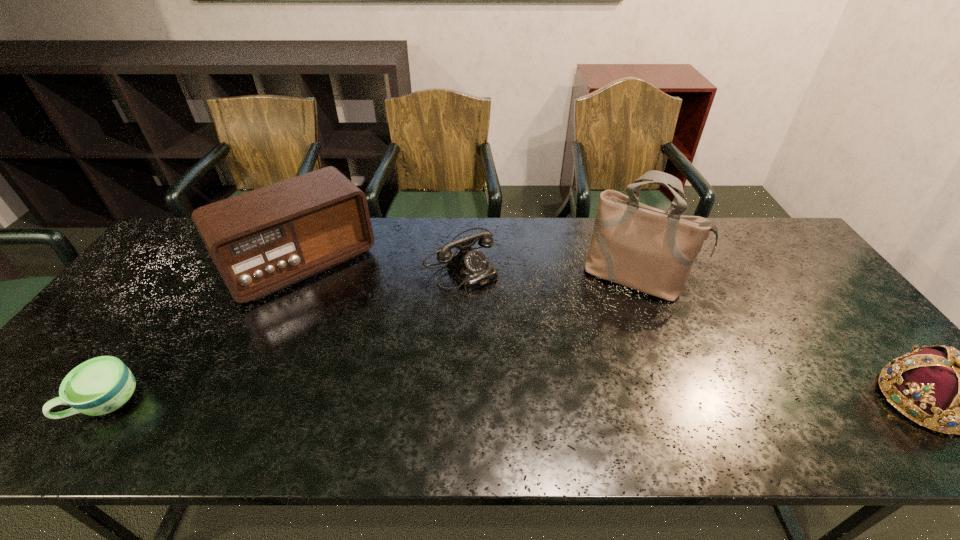
Where is `vacant area situated 0.330m on the front-facing side of the second object from right to left`? The image size is (960, 540). vacant area situated 0.330m on the front-facing side of the second object from right to left is located at coordinates (585, 389).

The width and height of the screenshot is (960, 540). Identify the location of free space located on the front-facing side of the second object from right to left. (589, 376).

This screenshot has width=960, height=540. What are the coordinates of `vacant space located on the front-facing side of the second object from right to left` in the screenshot? It's located at (583, 393).

The width and height of the screenshot is (960, 540). In order to click on vacant region located 0.250m on the front-facing side of the third object from right to left in this screenshot , I will do `click(529, 346)`.

Identify the location of free spot located on the front-facing side of the third object from right to left. This screenshot has width=960, height=540. (561, 383).

You are a GUI agent. You are given a task and a screenshot of the screen. Output one action in this format:
    pyautogui.click(x=<x>, y=<y>)
    Task: Click on the vacant space located 0.240m on the front-facing side of the third object from right to left
    The width and height of the screenshot is (960, 540).
    Given the screenshot: What is the action you would take?
    pyautogui.click(x=526, y=343)

You are a GUI agent. You are given a task and a screenshot of the screen. Output one action in this format:
    pyautogui.click(x=<x>, y=<y>)
    Task: Click on the radio receiver that is at the far edge
    The height and width of the screenshot is (540, 960).
    Given the screenshot: What is the action you would take?
    pyautogui.click(x=261, y=241)

Locate an element on the screen. shoulder bag at the far edge is located at coordinates (646, 249).

This screenshot has width=960, height=540. I want to click on telephone positioned at the far edge, so point(470,267).

Identify the location of object that is at the near edge. (101, 385).